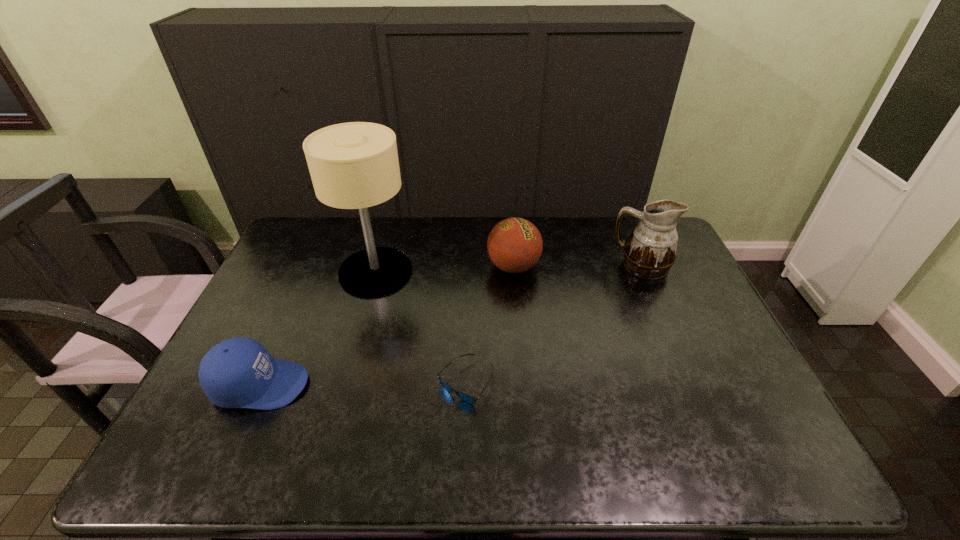
Image resolution: width=960 pixels, height=540 pixels. I want to click on unoccupied position between the shortest object and the tallest object, so click(420, 327).

I want to click on free space between the table lamp and the cap, so click(x=318, y=328).

In order to click on free space between the pitcher and the sunglasses in this screenshot , I will do `click(554, 324)`.

What are the coordinates of `vacant point located between the shortest object and the table lamp` in the screenshot? It's located at (420, 327).

Select which object appears as the fourth closest to the sunglasses. Please provide its 2D coordinates. Your answer should be formatted as a tuple, i.e. [(x, y)], where the tuple contains the x and y coordinates of a point satisfying the conditions above.

[(650, 251)]

Locate which object is the third closest to the pitcher. Please provide its 2D coordinates. Your answer should be formatted as a tuple, i.e. [(x, y)], where the tuple contains the x and y coordinates of a point satisfying the conditions above.

[(354, 165)]

Find the location of a particular element. vacant point that satisfies the following two spatial constraints: 1. from the spout of the second tallest object; 2. on the front side of the third tallest object is located at coordinates (642, 267).

At what (x,y) coordinates should I click in order to perform the action: click on free space that satisfies the following two spatial constraints: 1. at the front of the shortest object showing the lenses; 2. on the front-facing side of the cap. Please return your answer as a coordinate pair (x, y). The width and height of the screenshot is (960, 540). Looking at the image, I should click on (466, 385).

You are a GUI agent. You are given a task and a screenshot of the screen. Output one action in this format:
    pyautogui.click(x=<x>, y=<y>)
    Task: Click on the blank space that satisfies the following two spatial constraints: 1. on the back side of the table lamp; 2. on the right side of the third shortest object
    The width and height of the screenshot is (960, 540).
    Given the screenshot: What is the action you would take?
    pyautogui.click(x=377, y=267)

What are the coordinates of `vacant space that satisfies the following two spatial constraints: 1. at the front of the sunglasses showing the lenses; 2. on the front-facing side of the fourth tallest object` in the screenshot? It's located at (466, 385).